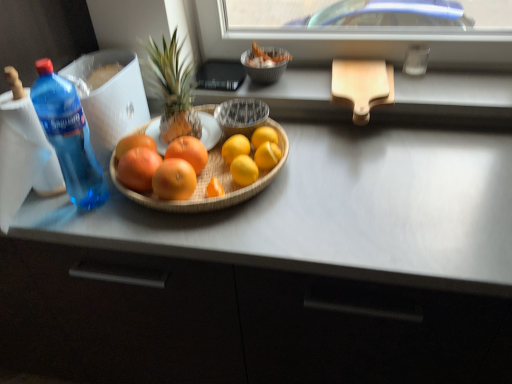
The width and height of the screenshot is (512, 384). Find the location of `free location in front of orange matte grapefruit at center, which is the fourth grapefruit from left to right`. free location in front of orange matte grapefruit at center, which is the fourth grapefruit from left to right is located at coordinates (184, 225).